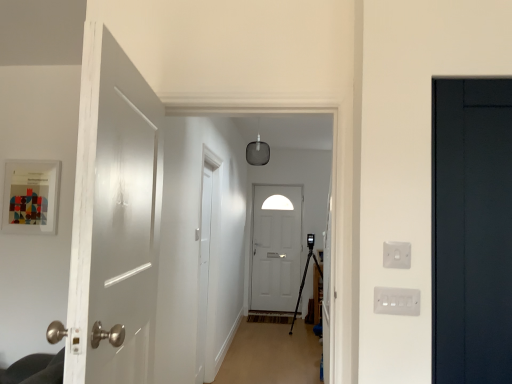
Question: Considering the relative sizes of white plastic electric outlet at right, positioned as the 1th electric outlet in top-to-bottom order, and wooden floor at center in the image provided, is white plastic electric outlet at right, positioned as the 1th electric outlet in top-to-bottom order, shorter than wooden floor at center?

Choices:
 (A) yes
 (B) no

Answer: (A)

Question: Are white plastic electric outlet at right, positioned as the 1th electric outlet in top-to-bottom order, and wooden floor at center beside each other?

Choices:
 (A) no
 (B) yes

Answer: (A)

Question: Is white plastic electric outlet at right, which is the 2th electric outlet from bottom to top, closer to camera compared to wooden floor at center?

Choices:
 (A) no
 (B) yes

Answer: (B)

Question: Is there a large distance between white plastic electric outlet at right, positioned as the 1th electric outlet in top-to-bottom order, and wooden floor at center?

Choices:
 (A) yes
 (B) no

Answer: (A)

Question: Is white plastic electric outlet at right, positioned as the 1th electric outlet in top-to-bottom order, further to the viewer compared to wooden floor at center?

Choices:
 (A) yes
 (B) no

Answer: (B)

Question: Considering the positions of dark wood door at right, the second door in the front-to-back sequence, and white matte door at center, which appears as the second door when viewed from the left, in the image, is dark wood door at right, the second door in the front-to-back sequence, wider or thinner than white matte door at center, which appears as the second door when viewed from the left,?

Choices:
 (A) thin
 (B) wide

Answer: (A)

Question: Is dark wood door at right, the second door in the front-to-back sequence, situated inside white matte door at center, the 3th door from the front, or outside?

Choices:
 (A) inside
 (B) outside

Answer: (B)

Question: Is point (449, 372) closer or farther from the camera than point (294, 190)?

Choices:
 (A) closer
 (B) farther

Answer: (A)

Question: Based on their sizes in the image, would you say dark wood door at right, arranged as the 1th door when viewed from the right, is bigger or smaller than white matte door at center, the 3th door from the front?

Choices:
 (A) small
 (B) big

Answer: (A)

Question: Is dark wood door at right, arranged as the 1th door when viewed from the right, wider or thinner than white glossy door at left, the 3th door viewed from the right?

Choices:
 (A) thin
 (B) wide

Answer: (A)

Question: Is dark wood door at right, arranged as the 1th door when viewed from the right, to the left or to the right of white glossy door at left, the first door when ordered from left to right, in the image?

Choices:
 (A) left
 (B) right

Answer: (B)

Question: Relative to white glossy door at left, the 3th door viewed from the right, is dark wood door at right, the 2th door positioned from the back, in front or behind?

Choices:
 (A) front
 (B) behind

Answer: (B)

Question: From their relative heights in the image, would you say dark wood door at right, the 2th door positioned from the back, is taller or shorter than white glossy door at left, the first door when ordered from left to right?

Choices:
 (A) tall
 (B) short

Answer: (B)

Question: Is white plastic switch at right, arranged as the 1th electric outlet when ordered from the bottom, wider or thinner than white matte door at center, which appears as the second door when viewed from the left?

Choices:
 (A) wide
 (B) thin

Answer: (B)

Question: From a real-world perspective, is white plastic switch at right, which is the 2th electric outlet from top to bottom, positioned above or below white matte door at center, which appears as the second door when viewed from the left?

Choices:
 (A) below
 (B) above

Answer: (B)